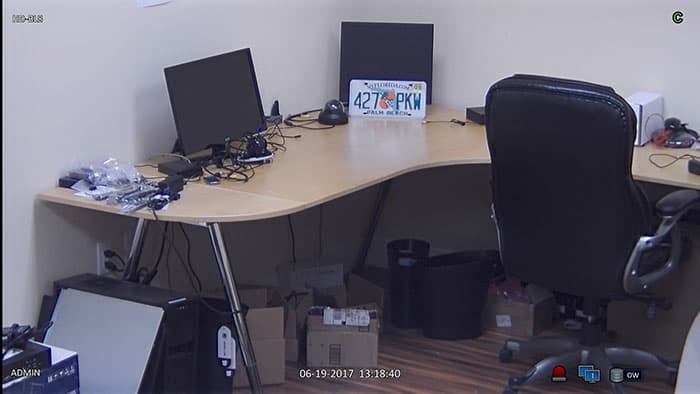
What are the coordinates of `right chair arm` in the screenshot? It's located at (680, 201).